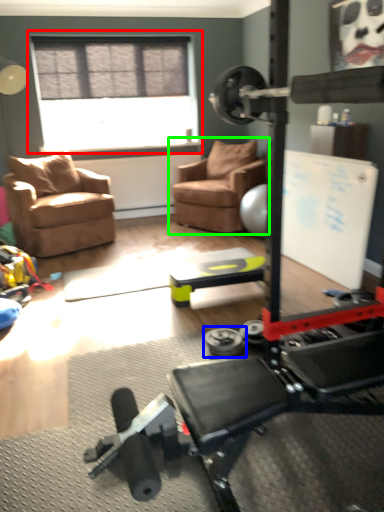
Question: Which is nearer to the window (highlighted by a red box)? dumbbell (highlighted by a blue box) or chair (highlighted by a green box).

Choices:
 (A) dumbbell
 (B) chair

Answer: (B)